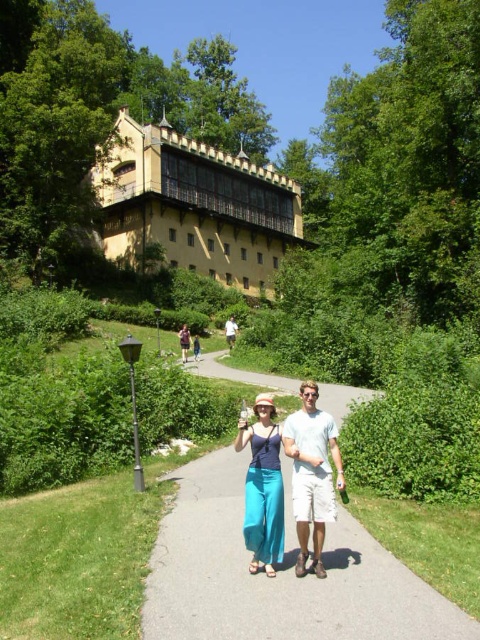
You are standing at point A and want to reach the gray concrete pavement at center located at point B. The coordinates of point A are given as (277,573). Can you determine the direction you need to move to reach the gray concrete pavement at center?

The gray concrete pavement at center is located at point B, which is the same coordinates as point A. Therefore, you are already at the gray concrete pavement at center.

You are a drone operator trying to capture a photo of the gray concrete pavement at center and the white cotton shirt at center from above. What is the minimum distance your drone must be able to fly to ensure it can capture both objects in the same frame?

The gray concrete pavement at center and white cotton shirt at center are 36.33 meters apart from each other. To capture both in the same frame, the drone must be able to fly at least 36.33 meters away from the closest object to ensure the entire distance between them is within the camera view.

You are standing at the lamppost on the left side of the path and want to walk to the point closer to you between point (266, 486) and point (226, 323). Which point should you head towards?

You should head towards point (266, 486) because it is closer to the viewer than point (226, 323).